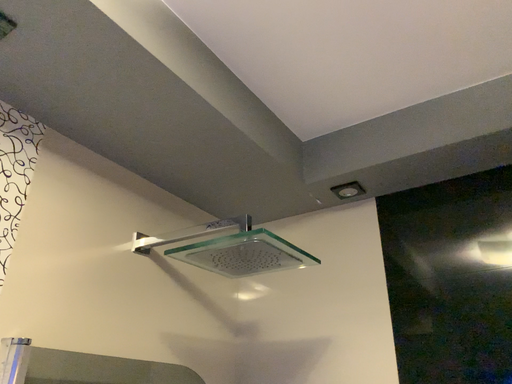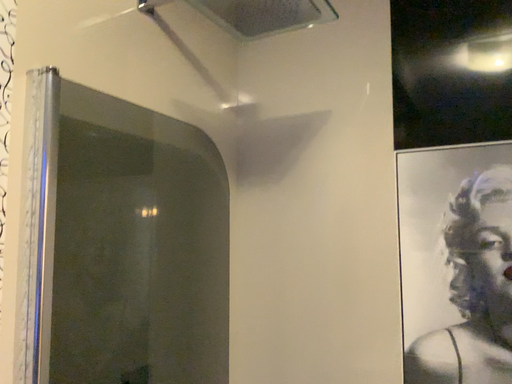
Question: How did the camera likely rotate when shooting the video?

Choices:
 (A) rotated downward
 (B) rotated upward

Answer: (A)